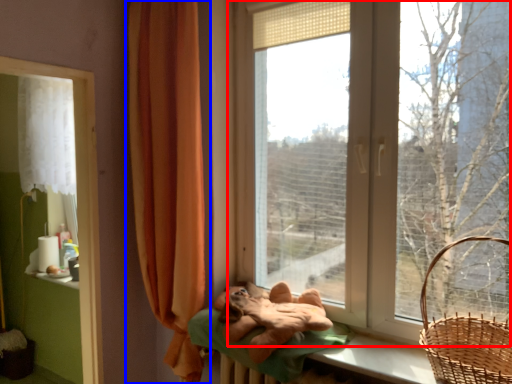
Question: Which point is further to the camera, window (highlighted by a red box) or curtain (highlighted by a blue box)?

Choices:
 (A) window
 (B) curtain

Answer: (B)